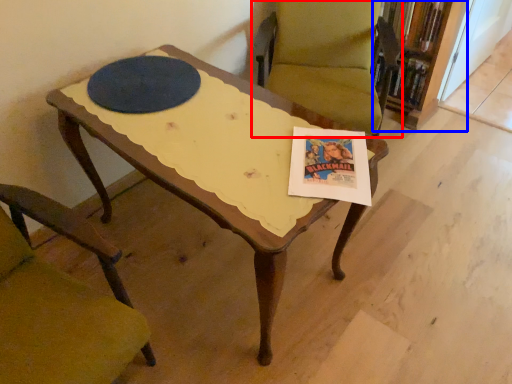
Question: Which point is further to the camera, chair (highlighted by a red box) or bookcase (highlighted by a blue box)?

Choices:
 (A) chair
 (B) bookcase

Answer: (B)